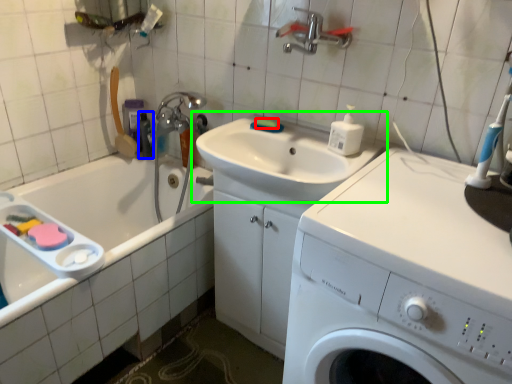
Question: Which object is positioned farthest from soap (highlighted by a red box)? Select from toiletry (highlighted by a blue box) and sink (highlighted by a green box).

Choices:
 (A) toiletry
 (B) sink

Answer: (A)